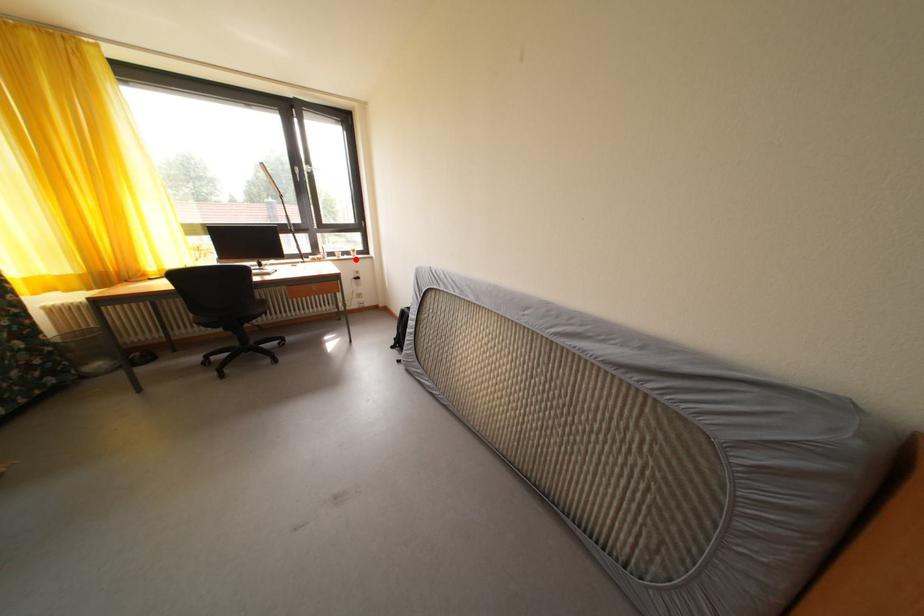
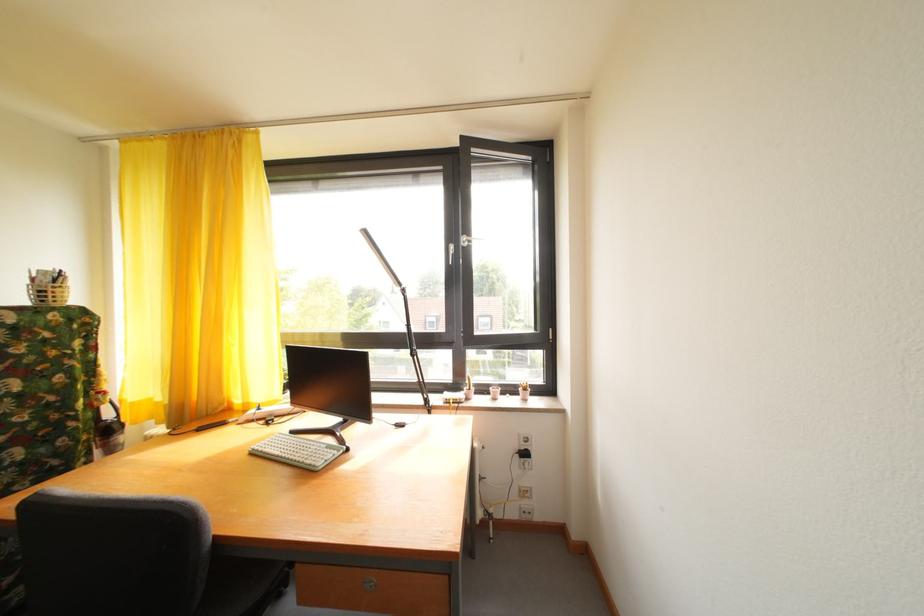
In the second image, find the point that corresponds to the highlighted location in the first image.

(520, 395)